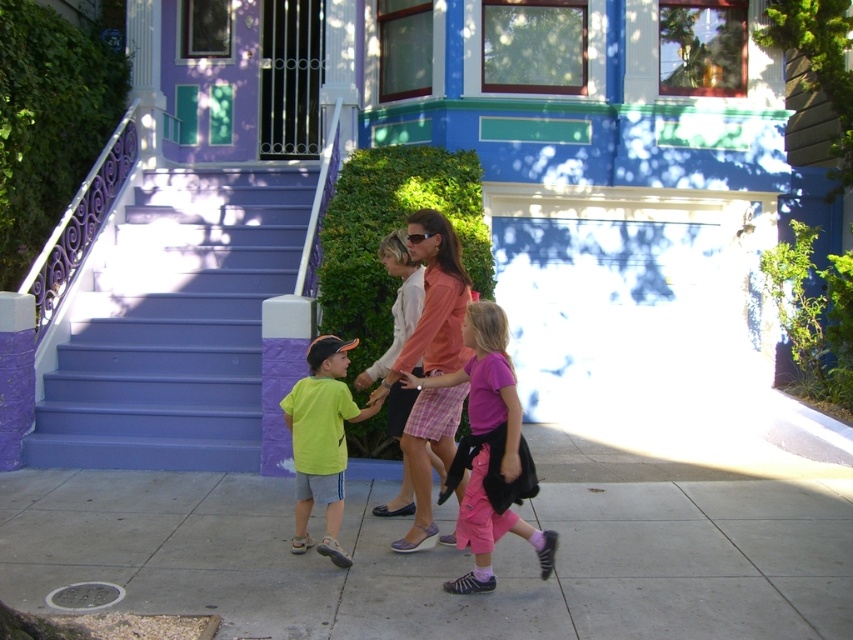
Can you confirm if pink fabric skirt at center is thinner than neon yellow t-shirt at center?

In fact, pink fabric skirt at center might be wider than neon yellow t-shirt at center.

Does pink fabric skirt at center lie in front of neon yellow t-shirt at center?

That is False.

Between point (416, 358) and point (322, 468), which one is positioned in front?

Positioned in front is point (322, 468).

The width and height of the screenshot is (853, 640). What are the coordinates of `pink fabric skirt at center` in the screenshot? It's located at (434, 301).

Who is shorter, purple painted stairs at left or pink cotton pants at center?

Standing shorter between the two is pink cotton pants at center.

Which is in front, point (196, 403) or point (511, 465)?

Point (511, 465) is more forward.

Which is behind, point (173, 416) or point (480, 401)?

The point (173, 416) is behind.

Image resolution: width=853 pixels, height=640 pixels. Identify the location of purple painted stairs at left. (177, 324).

Can you confirm if purple painted stairs at left is wider than neon yellow t-shirt at center?

Indeed, purple painted stairs at left has a greater width compared to neon yellow t-shirt at center.

Is purple painted stairs at left in front of neon yellow t-shirt at center?

No, it is behind neon yellow t-shirt at center.

Who is more forward, (242, 403) or (314, 448)?

Point (314, 448) is more forward.

Identify the location of purple painted stairs at left. (177, 324).